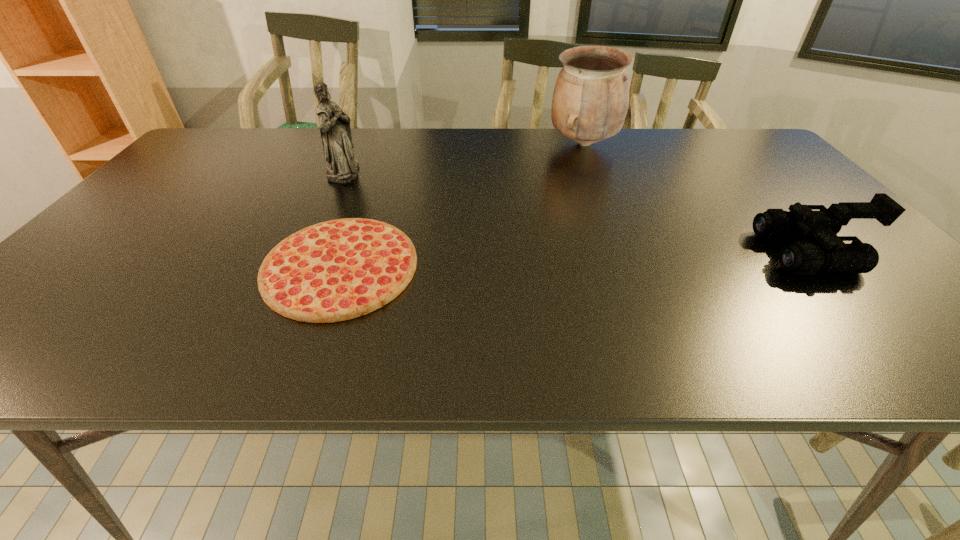
The image size is (960, 540). In order to click on vacant space located 0.140m on the left of the shortest object in this screenshot , I will do `click(201, 267)`.

Locate an element on the screen. The width and height of the screenshot is (960, 540). urn located in the far edge section of the desktop is located at coordinates (590, 100).

You are a GUI agent. You are given a task and a screenshot of the screen. Output one action in this format:
    pyautogui.click(x=<x>, y=<y>)
    Task: Click on the figurine that is at the far edge
    The height and width of the screenshot is (540, 960).
    Given the screenshot: What is the action you would take?
    [x=335, y=130]

Find the location of a particular element. object that is at the right edge is located at coordinates (833, 255).

The height and width of the screenshot is (540, 960). I want to click on free point at the far edge, so click(x=683, y=151).

Find the location of a particular element. The height and width of the screenshot is (540, 960). vacant space at the near edge of the desktop is located at coordinates (303, 341).

Locate an element on the screen. free space at the left edge of the desktop is located at coordinates (85, 314).

Locate an element on the screen. Image resolution: width=960 pixels, height=540 pixels. vacant space at the far left corner of the desktop is located at coordinates (195, 148).

Image resolution: width=960 pixels, height=540 pixels. What are the coordinates of `vacant position at the far right corner of the desktop` in the screenshot? It's located at 743,133.

Where is `vacant area between the pizza and the second object from right to left`? vacant area between the pizza and the second object from right to left is located at coordinates (462, 205).